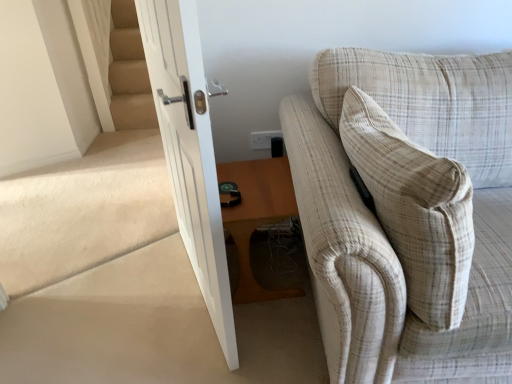
Measure the distance between beige plaid fabric couch at right and camera.

beige plaid fabric couch at right and camera are 37.00 inches apart from each other.

Where is `white plastic electric outlet at upper center`? white plastic electric outlet at upper center is located at coordinates (264, 139).

What is the approximate width of beige plaid pillow at right?

beige plaid pillow at right is 10.74 inches in width.

Measure the distance between point (430,183) and camera.

Point (430,183) and camera are 37.76 inches apart from each other.

Describe the element at coordinates (190, 150) in the screenshot. I see `white glossy door at center` at that location.

Locate an element on the screen. beige plaid fabric couch at right is located at coordinates pos(407,212).

Is beige plaid fabric couch at right not inside white glossy door at center?

Yes, beige plaid fabric couch at right is located beyond the bounds of white glossy door at center.

What are the coordinates of `studio couch that is under the white glossy door at center (from a real-world perspective)` in the screenshot? It's located at (407, 212).

Which of these two, beige plaid fabric couch at right or white glossy door at center, is wider?

Wider between the two is beige plaid fabric couch at right.

Which is closer to the camera, (276, 135) or (429, 218)?

The point (429, 218) is more forward.

In the scene shown: From the image's perspective, is white plastic electric outlet at upper center under beige plaid pillow at right?

Actually, white plastic electric outlet at upper center appears above beige plaid pillow at right in the image.

What's the angular difference between white plastic electric outlet at upper center and beige plaid pillow at right's facing directions?

white plastic electric outlet at upper center and beige plaid pillow at right are facing 90.6 degrees away from each other.

In the image, is beige carpeted stairs at left positioned in front of or behind white glossy door at center?

In the image, beige carpeted stairs at left appears behind white glossy door at center.

Based on the photo, which is more to the right, beige carpeted stairs at left or white glossy door at center?

Positioned to the right is white glossy door at center.

From the image's perspective, is beige carpeted stairs at left positioned above or below white glossy door at center?

beige carpeted stairs at left is situated higher than white glossy door at center in the image.

Based on the photo, is beige carpeted stairs at left situated inside white glossy door at center or outside?

beige carpeted stairs at left lies outside white glossy door at center.

Is the position of wooden table at lower center more distant than that of beige plaid pillow at right?

Yes, it is.

Is wooden table at lower center bigger or smaller than beige plaid pillow at right?

Considering their sizes, wooden table at lower center takes up less space than beige plaid pillow at right.

From the image's perspective, between wooden table at lower center and beige plaid pillow at right, which one is located above?

From the image's view, beige plaid pillow at right is above.

Which is in front, beige plaid fabric couch at right or wooden table at lower center?

beige plaid fabric couch at right.

Would you say wooden table at lower center is part of beige plaid fabric couch at right's contents?

No, wooden table at lower center is located outside of beige plaid fabric couch at right.

Does beige carpeted stairs at left have a larger size compared to beige plaid pillow at right?

Correct, beige carpeted stairs at left is larger in size than beige plaid pillow at right.

Looking at this image, is beige carpeted stairs at left spatially inside beige plaid pillow at right, or outside of it?

beige carpeted stairs at left cannot be found inside beige plaid pillow at right.

From a real-world perspective, does beige carpeted stairs at left sit lower than beige plaid pillow at right?

Yes, from a real-world perspective, beige carpeted stairs at left is below beige plaid pillow at right.

From a real-world perspective, is beige carpeted stairs at left located higher than beige plaid fabric couch at right?

Yes, from a real-world perspective, beige carpeted stairs at left is on top of beige plaid fabric couch at right.

Consider the image. Considering the relative sizes of beige carpeted stairs at left and beige plaid fabric couch at right in the image provided, is beige carpeted stairs at left smaller than beige plaid fabric couch at right?

Correct, beige carpeted stairs at left occupies less space than beige plaid fabric couch at right.

Who is more distant, beige carpeted stairs at left or beige plaid fabric couch at right?

beige carpeted stairs at left is further away from the camera.

At what (x,y) coordinates should I click in order to perform the action: click on door above the beige plaid fabric couch at right (from a real-world perspective). Please return your answer as a coordinate pair (x, y). Looking at the image, I should click on (190, 150).

Find the location of a particular element. The height and width of the screenshot is (384, 512). electric outlet that appears below the beige plaid pillow at right (from a real-world perspective) is located at coordinates (264, 139).

Looking at the image, which one is located closer to beige plaid fabric couch at right, white glossy door at center or beige carpeted stairs at left?

Based on the image, white glossy door at center appears to be nearer to beige plaid fabric couch at right.

Based on their spatial positions, is beige carpeted stairs at left or white plastic electric outlet at upper center further from beige plaid pillow at right?

Based on the image, beige carpeted stairs at left appears to be further to beige plaid pillow at right.

Estimate the real-world distances between objects in this image. Which object is closer to beige plaid pillow at right, wooden table at lower center or white plastic electric outlet at upper center?

Among the two, wooden table at lower center is located nearer to beige plaid pillow at right.

When comparing their distances from white glossy door at center, does wooden table at lower center or white plastic electric outlet at upper center seem closer?

Among the two, wooden table at lower center is located nearer to white glossy door at center.

Looking at the image, which one is located further to beige carpeted stairs at left, white plastic electric outlet at upper center or wooden table at lower center?

white plastic electric outlet at upper center.

From the image, which object appears to be farther from white glossy door at center, beige plaid fabric couch at right or wooden table at lower center?

The object further to white glossy door at center is beige plaid fabric couch at right.

Considering their positions, is wooden table at lower center positioned closer to beige plaid fabric couch at right than beige carpeted stairs at left?

The object closer to beige plaid fabric couch at right is wooden table at lower center.

Estimate the real-world distances between objects in this image. Which object is closer to beige plaid pillow at right, white glossy door at center or wooden table at lower center?

Based on the image, wooden table at lower center appears to be nearer to beige plaid pillow at right.

The width and height of the screenshot is (512, 384). Identify the location of table between white glossy door at center and white plastic electric outlet at upper center in the front-back direction. (258, 217).

At what (x,y) coordinates should I click in order to perform the action: click on table between beige plaid fabric couch at right and white plastic electric outlet at upper center from front to back. Please return your answer as a coordinate pair (x, y). Looking at the image, I should click on (258, 217).

Image resolution: width=512 pixels, height=384 pixels. Identify the location of table between beige carpeted stairs at left and beige plaid pillow at right from left to right. (258, 217).

Where is `door located between beige carpeted stairs at left and beige plaid pillow at right in the left-right direction`? The width and height of the screenshot is (512, 384). door located between beige carpeted stairs at left and beige plaid pillow at right in the left-right direction is located at coordinates (190, 150).